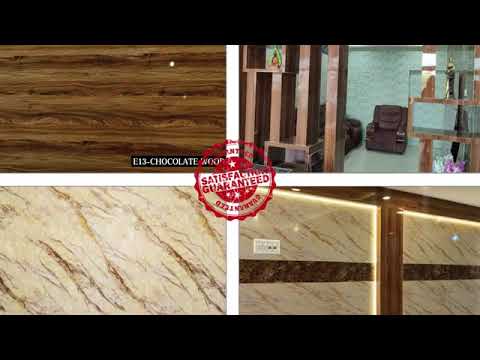
Where is `area right of light switch`? area right of light switch is located at coordinates (285, 245).